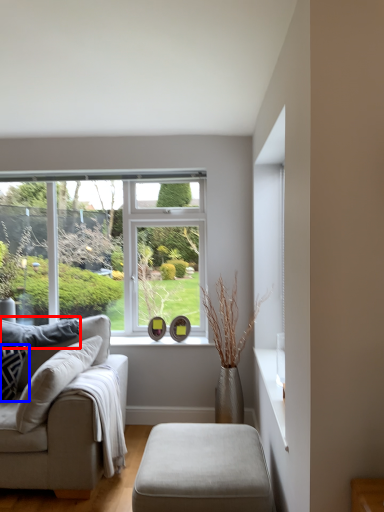
Question: Which point is further to the camera, pillow (highlighted by a red box) or pillow (highlighted by a blue box)?

Choices:
 (A) pillow
 (B) pillow

Answer: (A)